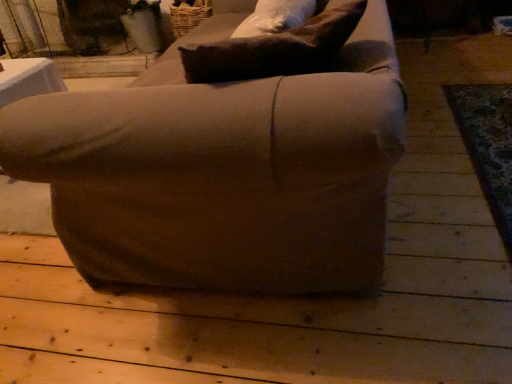
Question: Should I look upward or downward to see matte brown armchair at center?

Choices:
 (A) up
 (B) down

Answer: (A)

Question: Is the depth of matte brown armchair at center greater than that of brown fabric pillow at upper center?

Choices:
 (A) yes
 (B) no

Answer: (B)

Question: Is matte brown armchair at center oriented towards brown fabric pillow at upper center?

Choices:
 (A) yes
 (B) no

Answer: (A)

Question: Is matte brown armchair at center far from brown fabric pillow at upper center?

Choices:
 (A) yes
 (B) no

Answer: (B)

Question: Is matte brown armchair at center taller than brown fabric pillow at upper center?

Choices:
 (A) yes
 (B) no

Answer: (A)

Question: From a real-world perspective, does matte brown armchair at center stand above brown fabric pillow at upper center?

Choices:
 (A) no
 (B) yes

Answer: (A)

Question: From a real-world perspective, is matte brown armchair at center physically below brown fabric pillow at upper center?

Choices:
 (A) yes
 (B) no

Answer: (A)

Question: Is brown fabric pillow at upper center turned away from matte brown armchair at center?

Choices:
 (A) no
 (B) yes

Answer: (B)

Question: From the image's perspective, is brown fabric pillow at upper center below matte brown armchair at center?

Choices:
 (A) no
 (B) yes

Answer: (B)

Question: Considering the relative sizes of brown fabric pillow at upper center and matte brown armchair at center in the image provided, is brown fabric pillow at upper center smaller than matte brown armchair at center?

Choices:
 (A) yes
 (B) no

Answer: (A)

Question: Is brown fabric pillow at upper center behind matte brown armchair at center?

Choices:
 (A) yes
 (B) no

Answer: (A)

Question: Is the position of brown fabric pillow at upper center less distant than that of matte brown armchair at center?

Choices:
 (A) no
 (B) yes

Answer: (A)

Question: From a real-world perspective, is brown fabric pillow at upper center located higher than matte brown armchair at center?

Choices:
 (A) yes
 (B) no

Answer: (A)

Question: Considering their positions, is brown fabric pillow at upper center located in front of or behind matte brown armchair at center?

Choices:
 (A) front
 (B) behind

Answer: (B)